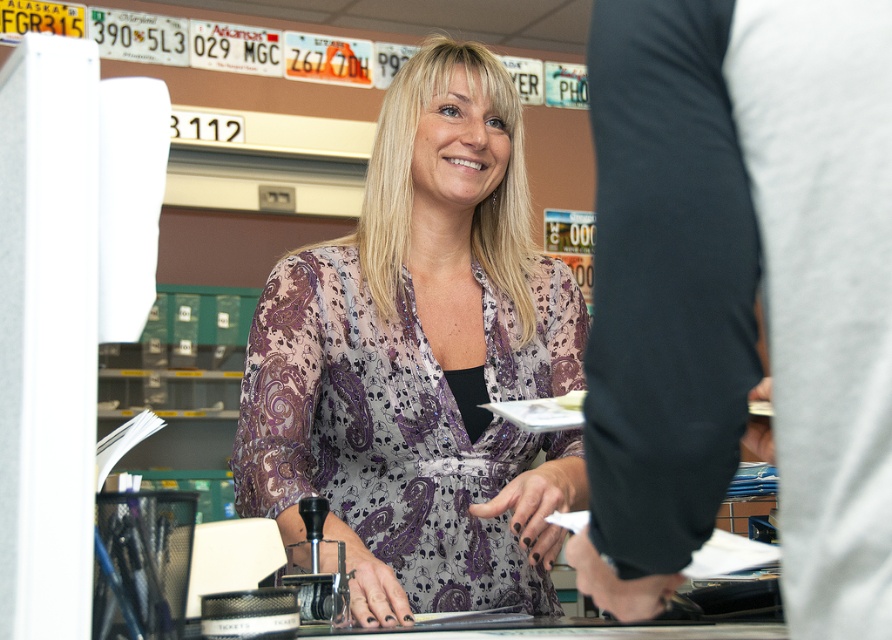
You are an assistant who needs to determine which item is smaller between the white fabric pants at lower right and the purple paisley blouse at center. Based on the scene description, which one is smaller?

The white fabric pants at lower right has a smaller size compared to the purple paisley blouse at center.

You are an assistant helping to organize a clothing donation drive. You have two items to place in boxes labeled for pants and shirts. The white fabric pants at lower right and the purple paisley blouse at center are both in front of you. Based on their widths, which box should each item go into?

The white fabric pants at lower right should go into the pants box because its width is narrower than the purple paisley blouse at center, which belongs in the shirts box.

You are an interior designer assessing the layout of an office. You notice the white fabric pants at lower right and the purple paisley blouse at center. Which item is closer to the bottom edge of the image?

The white fabric pants at lower right are closer to the bottom edge of the image because they are positioned lower than the purple paisley blouse at center.